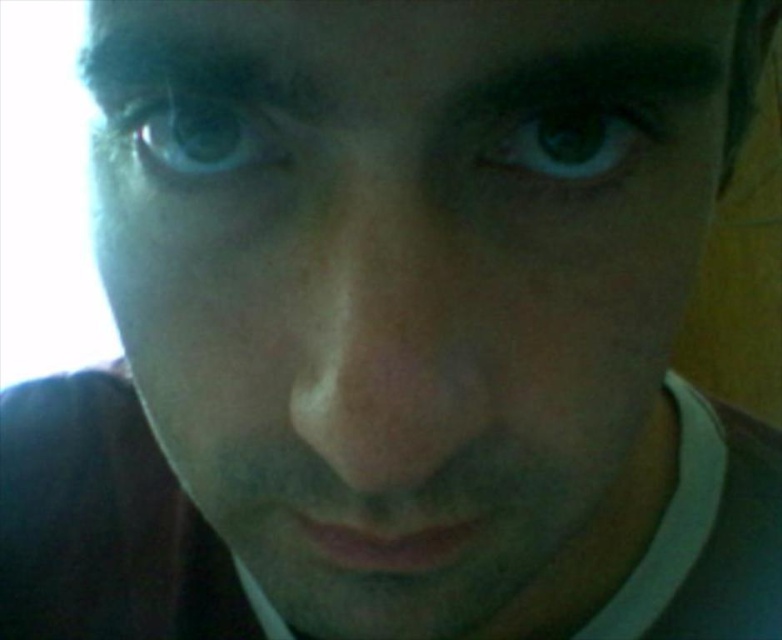
Question: Which of the following is the farthest from the observer?

Choices:
 (A) blue iridescent eye at upper left
 (B) brown matte eye at center

Answer: (A)

Question: Does brown matte eye at center come in front of blue iridescent eye at upper left?

Choices:
 (A) no
 (B) yes

Answer: (B)

Question: Does brown matte eye at center appear on the left side of blue iridescent eye at upper left?

Choices:
 (A) no
 (B) yes

Answer: (A)

Question: Which object is closer to the camera taking this photo?

Choices:
 (A) brown matte eye at center
 (B) blue iridescent eye at upper left

Answer: (A)

Question: Does brown matte eye at center appear on the left side of blue iridescent eye at upper left?

Choices:
 (A) yes
 (B) no

Answer: (B)